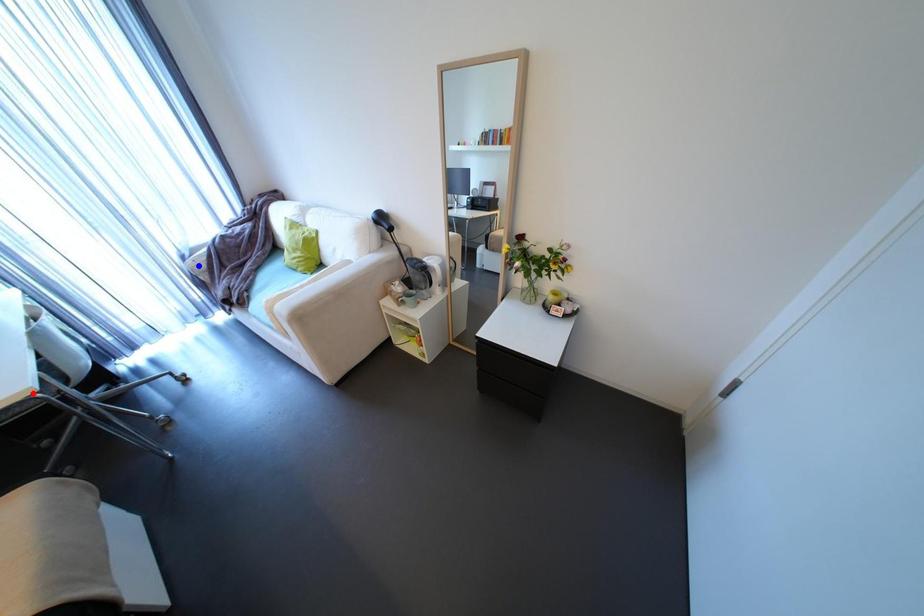
Question: Two points are marked on the image. Which point is closer to the camera?

Choices:
 (A) Blue point is closer.
 (B) Red point is closer.

Answer: (B)